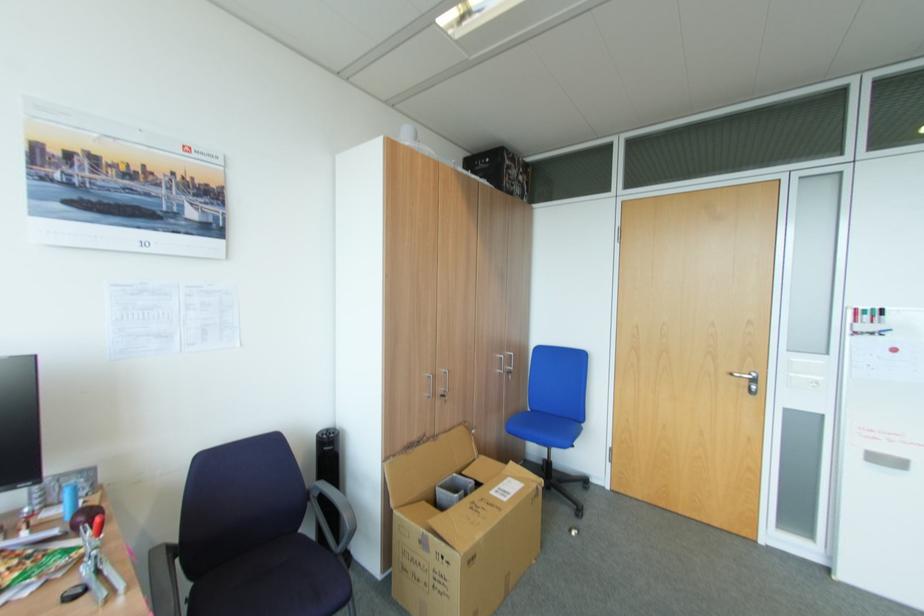
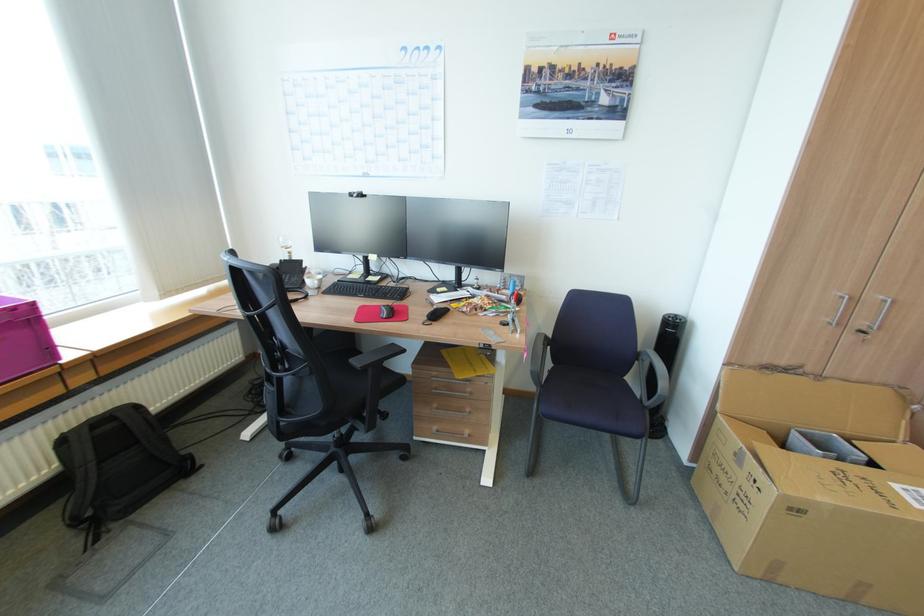
Find the pixel in the second image that matches the point at 450,370 in the first image.

(888, 297)